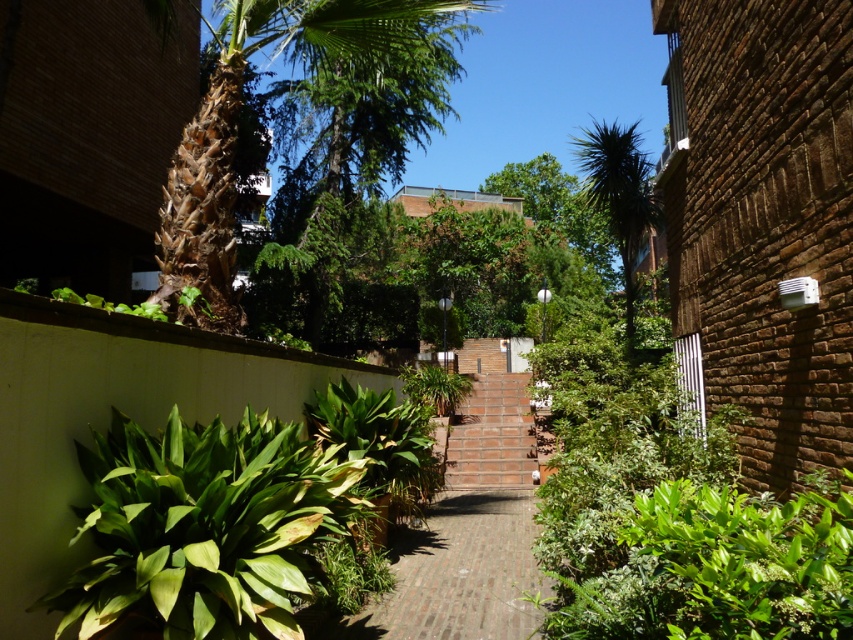
Where is `brown textured palm tree at upper left`? The width and height of the screenshot is (853, 640). brown textured palm tree at upper left is located at coordinates [x=236, y=125].

Locate an element on the screen. This screenshot has height=640, width=853. brown textured palm tree at upper left is located at coordinates (236, 125).

Does brick at center come in front of brown textured palm tree at upper left?

Yes, it is.

Between brick at center and brown textured palm tree at upper left, which one is positioned higher?

brown textured palm tree at upper left is higher up.

Where is `brick at center`? brick at center is located at coordinates (x=471, y=524).

This screenshot has height=640, width=853. Find the location of `brick at center`. brick at center is located at coordinates (471, 524).

Does brick at center appear on the left side of green leafy palm tree at center?

Indeed, brick at center is positioned on the left side of green leafy palm tree at center.

Is brick at center above green leafy palm tree at center?

Incorrect, brick at center is not positioned above green leafy palm tree at center.

Is point (521, 532) positioned before point (635, 186)?

Yes, point (521, 532) is in front of point (635, 186).

I want to click on brick at center, so click(x=471, y=524).